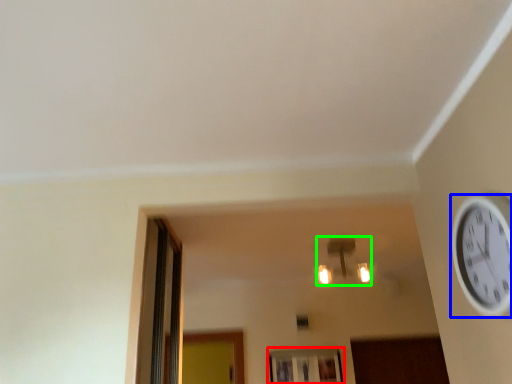
Question: Which is farther away from window (highlighted by a red box)? wall clock (highlighted by a blue box) or light fixture (highlighted by a green box)?

Choices:
 (A) wall clock
 (B) light fixture

Answer: (A)